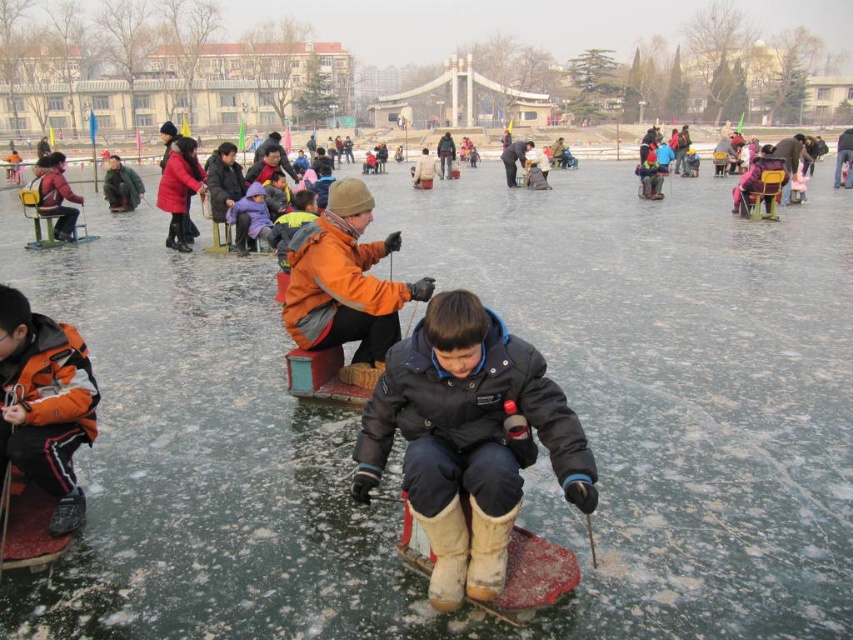
You are a photographer trying to capture a clear photo of the orange woolen sweater at center. However, the dark gray woolen hat at upper center is blocking your view. Can you determine if you can adjust your position to avoid the obstruction?

The dark gray woolen hat at upper center is in front of the orange woolen sweater at center, so moving your camera position slightly backward or to the side might allow you to see the orange woolen sweater at center without the obstruction.

You are a winter sports instructor planning to set up a safety zone for ice fishing participants. The safety guidelines require a minimum distance of 100 feet between any two participants to prevent ice from cracking. Given the dark blue matte jacket at center and the matte black jacket at left, do these two participants meet the safety distance requirement?

The distance between the dark blue matte jacket at center and the matte black jacket at left is 101.26 feet, which exceeds the required 100 feet minimum. Therefore, these two participants meet the safety distance requirement.

Looking at this image, you are a photographer trying to capture a clear shot of the dark blue matte jacket at center and the dark gray woolen hat at upper center. Based on their positions, can you tell which object is closer to the camera?

The dark blue matte jacket at center is below the dark gray woolen hat at upper center, so the dark blue matte jacket at center is closer to the camera.